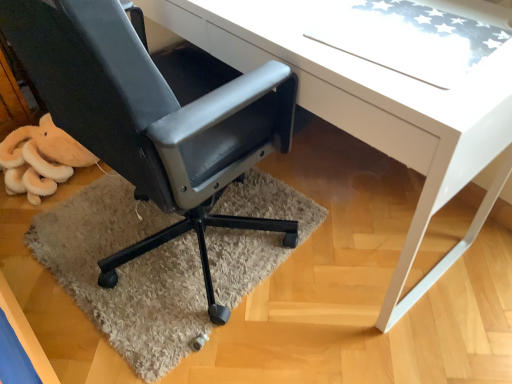
Question: Does white glossy desk at center turn towards matte black office chair at lower left?

Choices:
 (A) no
 (B) yes

Answer: (B)

Question: From the image's perspective, is white glossy desk at center located beneath matte black office chair at lower left?

Choices:
 (A) yes
 (B) no

Answer: (B)

Question: From the image's perspective, is white glossy desk at center over matte black office chair at lower left?

Choices:
 (A) no
 (B) yes

Answer: (B)

Question: Is white glossy desk at center far away from matte black office chair at lower left?

Choices:
 (A) no
 (B) yes

Answer: (A)

Question: Is white glossy desk at center looking in the opposite direction of matte black office chair at lower left?

Choices:
 (A) no
 (B) yes

Answer: (B)

Question: Considering the positions of point (264, 66) and point (386, 145), is point (264, 66) closer or farther from the camera than point (386, 145)?

Choices:
 (A) farther
 (B) closer

Answer: (A)

Question: From a real-world perspective, is matte black office chair at lower left physically located above or below white glossy desk at center?

Choices:
 (A) below
 (B) above

Answer: (B)

Question: Considering the positions of matte black office chair at lower left and white glossy desk at center in the image, is matte black office chair at lower left wider or thinner than white glossy desk at center?

Choices:
 (A) thin
 (B) wide

Answer: (B)

Question: In terms of height, does matte black office chair at lower left look taller or shorter compared to white glossy desk at center?

Choices:
 (A) tall
 (B) short

Answer: (A)

Question: Is point (291, 1) positioned closer to the camera than point (185, 81)?

Choices:
 (A) closer
 (B) farther

Answer: (A)

Question: Based on their sizes in the image, would you say white glossy desk at center is bigger or smaller than matte black office chair at lower left?

Choices:
 (A) big
 (B) small

Answer: (A)

Question: In the image, is white glossy desk at center on the left side or the right side of matte black office chair at lower left?

Choices:
 (A) right
 (B) left

Answer: (A)

Question: Looking at their shapes, would you say white glossy desk at center is wider or thinner than matte black office chair at lower left?

Choices:
 (A) wide
 (B) thin

Answer: (B)

Question: Is beige shaggy rug at lower left taller or shorter than white glossy desk at center?

Choices:
 (A) short
 (B) tall

Answer: (A)

Question: From the image's perspective, relative to white glossy desk at center, is beige shaggy rug at lower left above or below?

Choices:
 (A) below
 (B) above

Answer: (A)